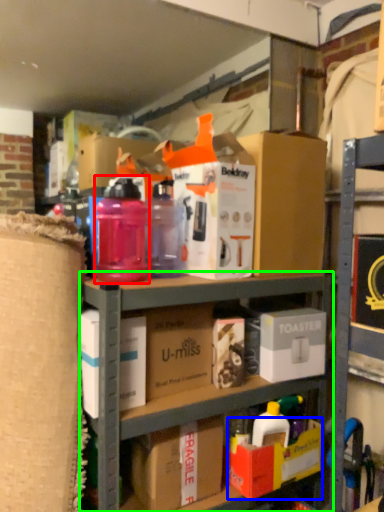
Question: Considering the real-world distances, which object is closest to bottle (highlighted by a red box)? box (highlighted by a blue box) or shelf (highlighted by a green box).

Choices:
 (A) box
 (B) shelf

Answer: (B)